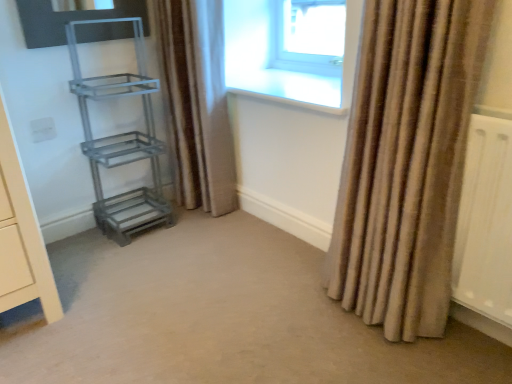
Find the location of a particular element. This screenshot has width=512, height=384. free space between beige textured curtain at right, the 1th curtain viewed from the right, and metallic gray shelf at lower left, the first shelf positioned from the bottom is located at coordinates (233, 263).